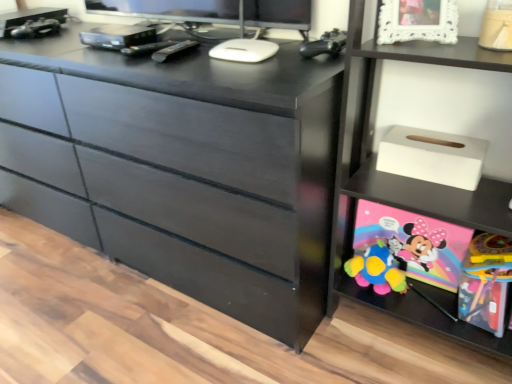
Where is `vacant region to the left of black matte controller at upper right, placed as the 2th toy when sorted from right to left`? vacant region to the left of black matte controller at upper right, placed as the 2th toy when sorted from right to left is located at coordinates (271, 65).